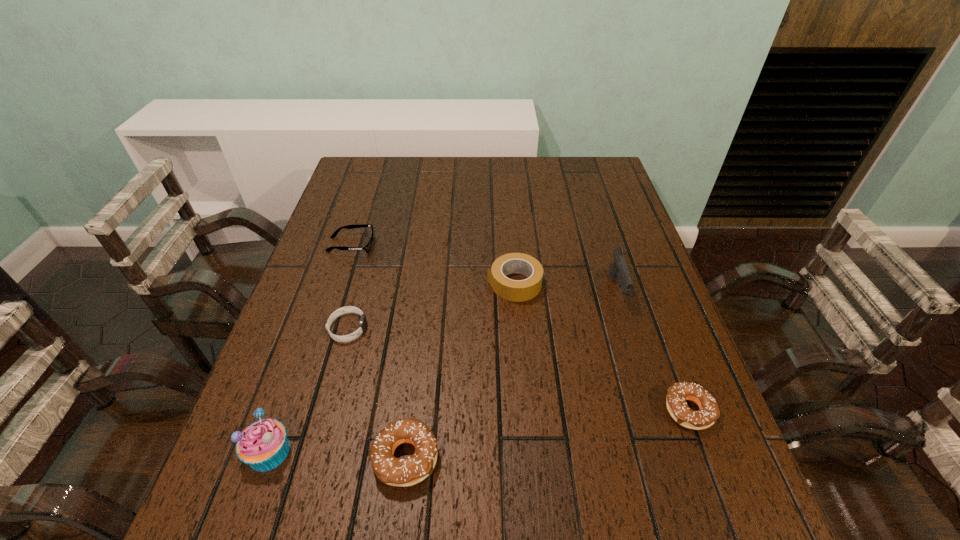
In order to click on empty space that is in between the sunglasses and the third object from right to left in this screenshot , I will do pyautogui.click(x=433, y=264).

Locate an element on the screen. Image resolution: width=960 pixels, height=540 pixels. object that can be found as the fifth closest to the second object from right to left is located at coordinates (367, 248).

Where is `object that is the nearest to the shorter doughnut`? Image resolution: width=960 pixels, height=540 pixels. object that is the nearest to the shorter doughnut is located at coordinates (618, 267).

The image size is (960, 540). In order to click on free spot that satisfies the following two spatial constraints: 1. on the outer surface of the fourth object from right to left; 2. on the left side of the fourth nearest object in this screenshot , I will do `click(312, 457)`.

Find the location of `free space that satisfies the following two spatial constraints: 1. on the outer surface of the third shortest object; 2. on the right side of the fourth nearest object`. free space that satisfies the following two spatial constraints: 1. on the outer surface of the third shortest object; 2. on the right side of the fourth nearest object is located at coordinates (325, 410).

Locate an element on the screen. This screenshot has width=960, height=540. free spot that satisfies the following two spatial constraints: 1. on the front-facing side of the farthest object; 2. on the right side of the fourth object from right to left is located at coordinates (282, 457).

Image resolution: width=960 pixels, height=540 pixels. I want to click on vacant region that satisfies the following two spatial constraints: 1. on the front-facing side of the sunglasses; 2. on the back side of the fourth object from left to right, so click(282, 457).

You are a GUI agent. You are given a task and a screenshot of the screen. Output one action in this format:
    pyautogui.click(x=<x>, y=<y>)
    Task: Click on the vacant space that satisfies the following two spatial constraints: 1. on the front-facing side of the sunglasses; 2. on the front side of the muffin
    This screenshot has width=960, height=540.
    Given the screenshot: What is the action you would take?
    pyautogui.click(x=284, y=451)

Identify the location of vacant region that satisfies the following two spatial constraints: 1. on the front-facing side of the sunglasses; 2. on the right side of the fifth tallest object. This screenshot has width=960, height=540. (298, 410).

This screenshot has width=960, height=540. I want to click on vacant space that satisfies the following two spatial constraints: 1. on the front-facing side of the sunglasses; 2. on the right side of the left doughnut, so click(282, 457).